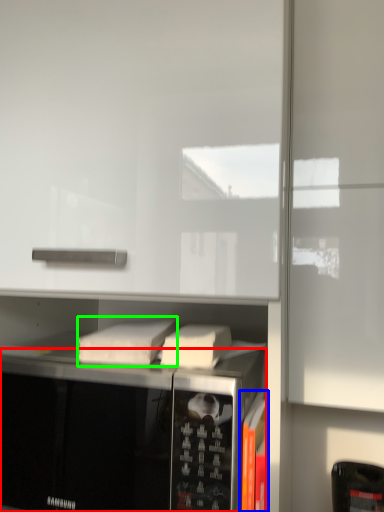
Question: Based on their relative distances, which object is nearer to microwave oven (highlighted by a red box)? Choose from book (highlighted by a blue box) and book (highlighted by a green box).

Choices:
 (A) book
 (B) book

Answer: (B)